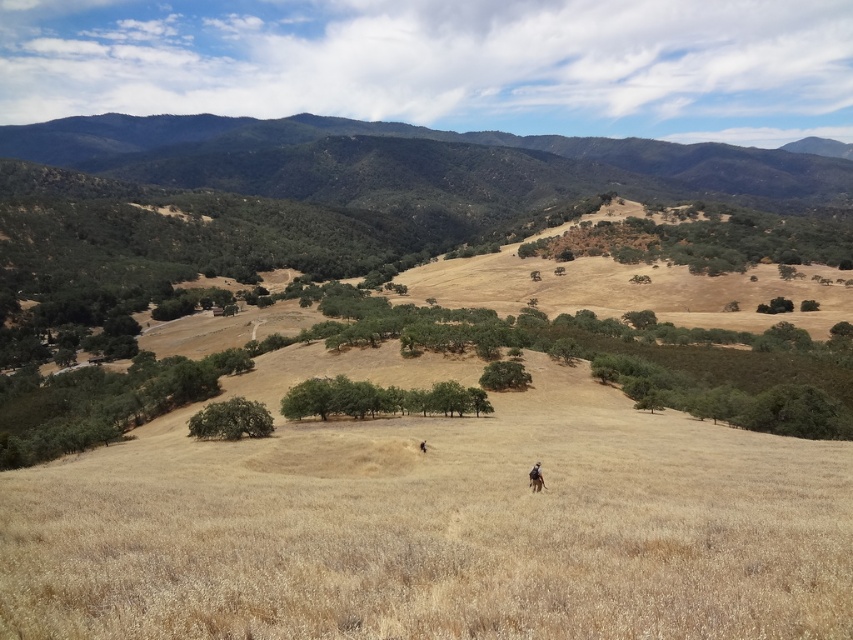
You are standing at the origin point of the coordinate system in the image. You want to walk towards the green leafy trees at center. What direction should you head in?

The green leafy trees at center are located at coordinate point (x=378, y=397), so you should head towards the direction of increasing x and y coordinates to reach them.

You are standing at the point marked as point (378, 397) in the image. What type of vegetation do you see around you?

The point (378, 397) is on green leafy trees at center, so you are surrounded by green leafy trees.